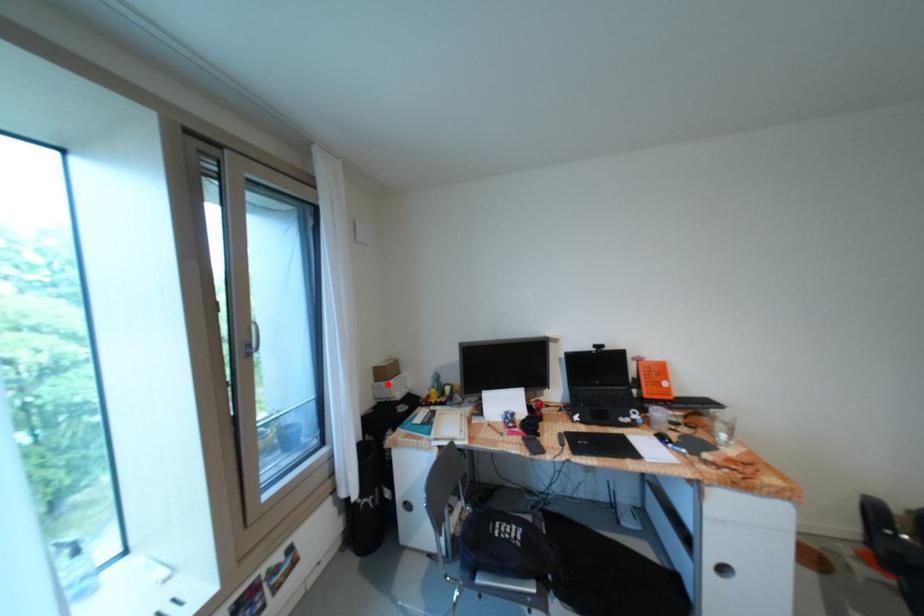
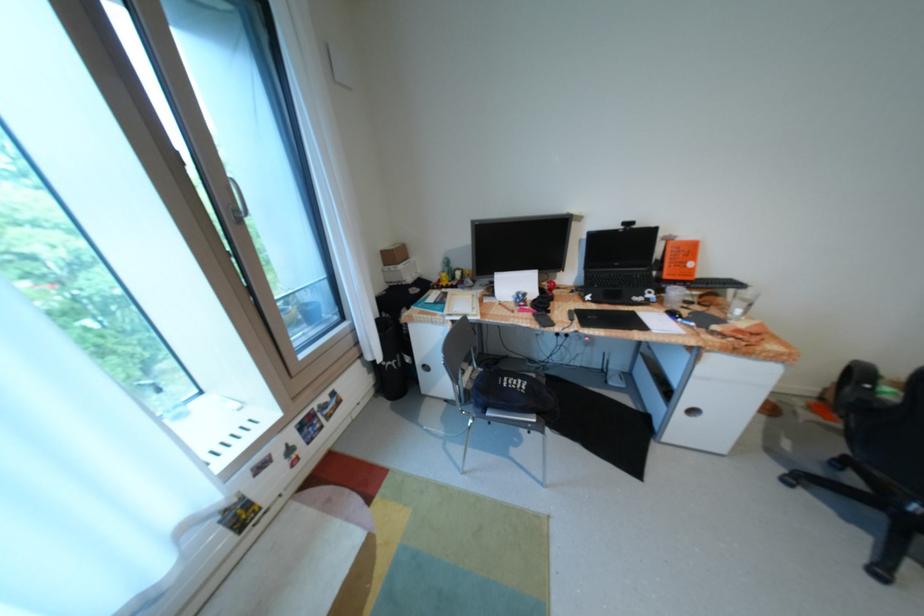
Question: A red point is marked in image1. In image2, is the corresponding 3D point closer to the camera or farther? Reply with the corresponding letter.

Choices:
 (A) The corresponding 3D point is closer.
 (B) The corresponding 3D point is farther.

Answer: (A)